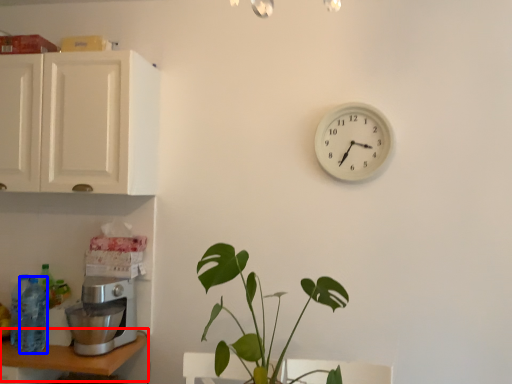
Question: Among these objects, which one is farthest to the camera, table (highlighted by a red box) or bottle (highlighted by a blue box)?

Choices:
 (A) table
 (B) bottle

Answer: (B)